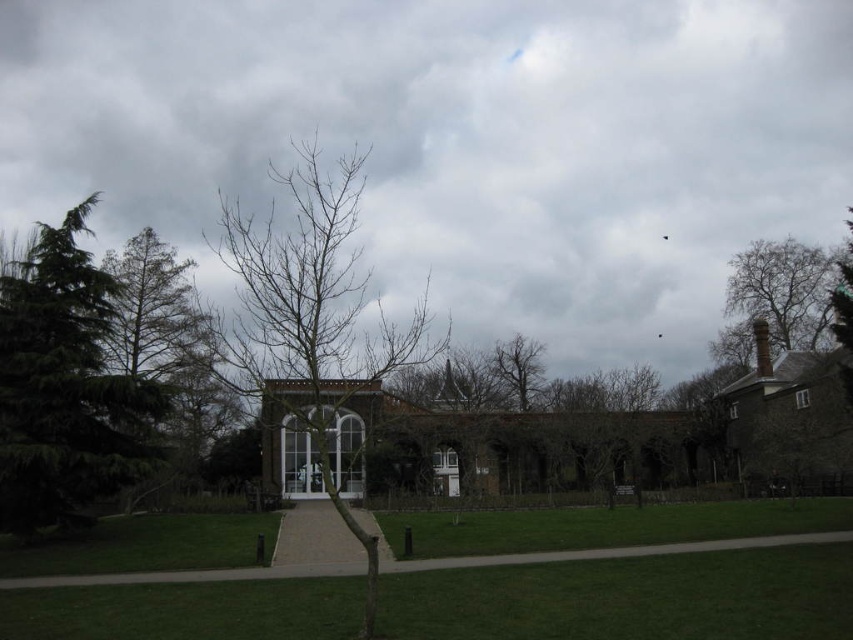
Question: Which of the following is the closest to the observer?

Choices:
 (A) (746, 332)
 (B) (51, 273)
 (C) (798, 632)

Answer: (C)

Question: From the image, what is the correct spatial relationship of bare branches at upper right in relation to gravel path at lower center?

Choices:
 (A) above
 (B) below

Answer: (A)

Question: Among these objects, which one is farthest from the camera?

Choices:
 (A) gravel path at lower center
 (B) bare branches at center
 (C) bare branches at upper right
 (D) green coniferous tree at left

Answer: (C)

Question: Does green grass at center have a smaller size compared to green coniferous tree at left?

Choices:
 (A) yes
 (B) no

Answer: (B)

Question: Can you confirm if green grass at center is thinner than bare branches at upper right?

Choices:
 (A) yes
 (B) no

Answer: (B)

Question: Which object is closer to the camera taking this photo?

Choices:
 (A) green grass at center
 (B) bare branches at center
 (C) green coniferous tree at left

Answer: (A)